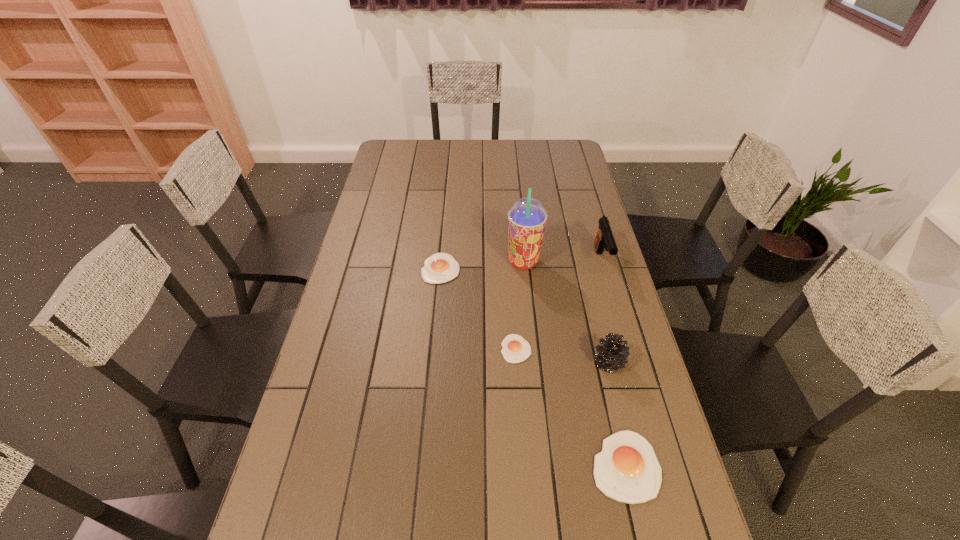
This screenshot has height=540, width=960. In order to click on free point at the far edge in this screenshot , I will do `click(424, 165)`.

Where is `blank area at the left edge`? Image resolution: width=960 pixels, height=540 pixels. blank area at the left edge is located at coordinates (387, 281).

The image size is (960, 540). I want to click on free region at the right edge of the desktop, so click(628, 367).

Identify the location of vacant space at the far left corner of the desktop. (403, 150).

Identify the location of vacant space at the near left corner of the desktop. (334, 511).

Identify the location of free location at the far right corner of the desktop. (549, 153).

Where is `free space at the near right corner of the desktop`? This screenshot has width=960, height=540. free space at the near right corner of the desktop is located at coordinates (639, 520).

At what (x,y) coordinates should I click in order to perform the action: click on vacant point located between the pistol and the smoothie. Please return your answer as a coordinate pair (x, y). The height and width of the screenshot is (540, 960). Looking at the image, I should click on (563, 261).

The width and height of the screenshot is (960, 540). What are the coordinates of `free space that is in between the tallest object and the nearest egg yolk` in the screenshot? It's located at (574, 364).

Locate an element on the screen. vacant space that's between the pistol and the smoothie is located at coordinates [x=563, y=261].